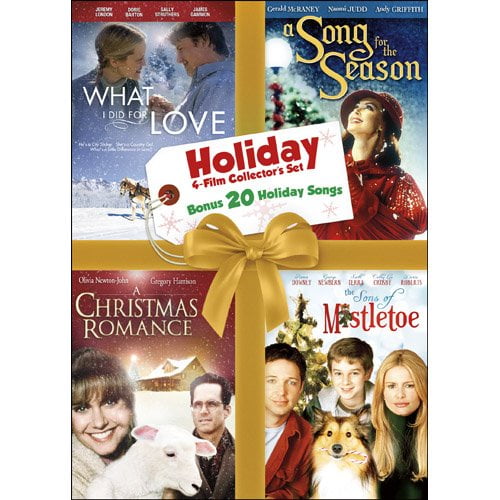
Locate an element on the screen. The image size is (500, 500). dvd movie covers is located at coordinates (160, 107), (330, 92), (374, 371), (161, 392).